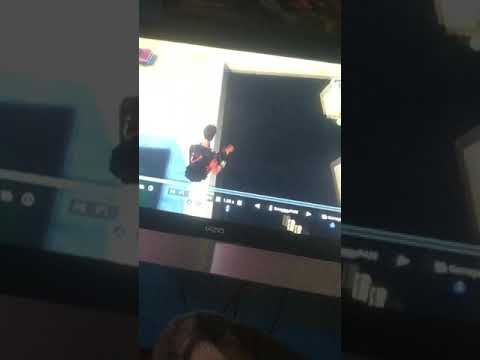
I want to click on dark doorway, so click(271, 118).